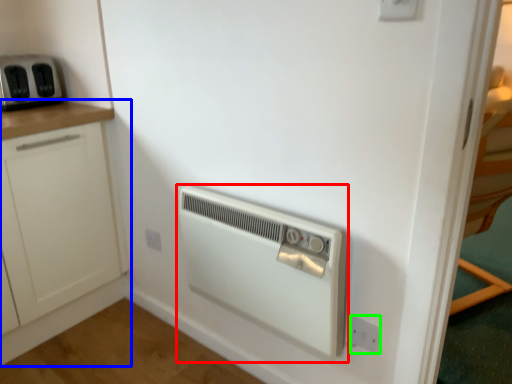
Question: Which object is the closest to the home appliance (highlighted by a red box)? Choose among these: cabinetry (highlighted by a blue box) or electric outlet (highlighted by a green box).

Choices:
 (A) cabinetry
 (B) electric outlet

Answer: (B)